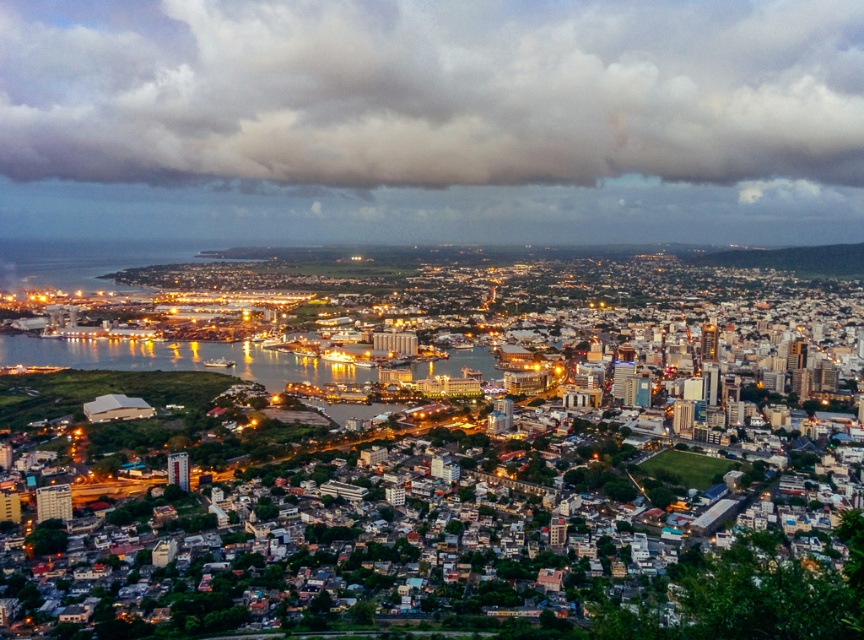
You are an architect evaluating the city layout. You notice the matte urban landscape at lower left and the gray cotton cloud at upper center. Which of these two elements occupies a greater area in the scene?

→ The matte urban landscape at lower left has a larger size compared to the gray cotton cloud at upper center, so it occupies a greater area in the scene.

Based on the photo, you are an architect reviewing a city model. You notice the matte urban landscape at lower left and the gray cotton cloud at upper center. Which object is closer to your viewpoint?

The matte urban landscape at lower left is closer to your viewpoint because it is positioned in front of the gray cotton cloud at upper center.

You are an architect reviewing a city model. You notice two elements in the model, the matte urban landscape at lower left and the gray cotton cloud at upper center. According to the model, which element is positioned to the right of the other?

The matte urban landscape at lower left is positioned to the right of the gray cotton cloud at upper center.